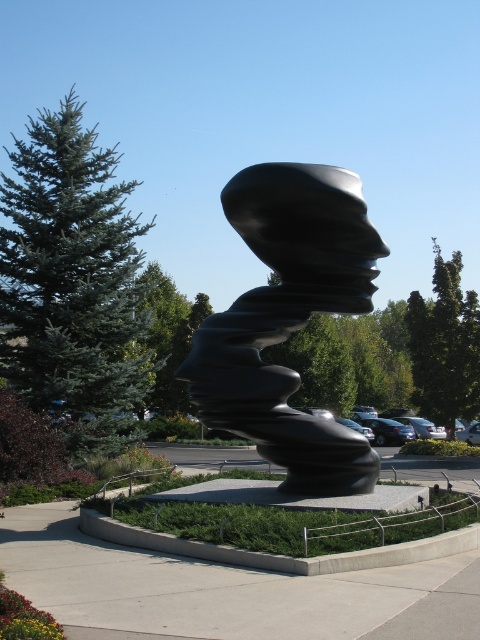
You are standing in front of the sculpture and want to move from point A to point B. Point A is at coordinates point (363,282) and point B is at coordinates point (326,211). Which direction should you move to go from point A to point B?

To move from point A at coordinates point (363,282) to point B at coordinates point (326,211), you should move forward since point A is behind point B according to the spatial arrangement described.

You are an art student analyzing the sculpture in the plaza. You notice two parts of the sculpture labeled as the black polished sculpture at center and the black polished head at center. Which part is wider?

The black polished sculpture at center is wider than the black polished head at center.

Looking at this image, you are an art student standing in front of the sculpture. You want to take a photo of the black polished sculpture at center and the black polished head at center without any obstruction. Which object should you position closer to you to ensure both are visible clearly?

You should position yourself closer to the black polished sculpture at center because the black polished head at center is behind it, so moving closer to the sculpture will help ensure both are visible without obstruction.